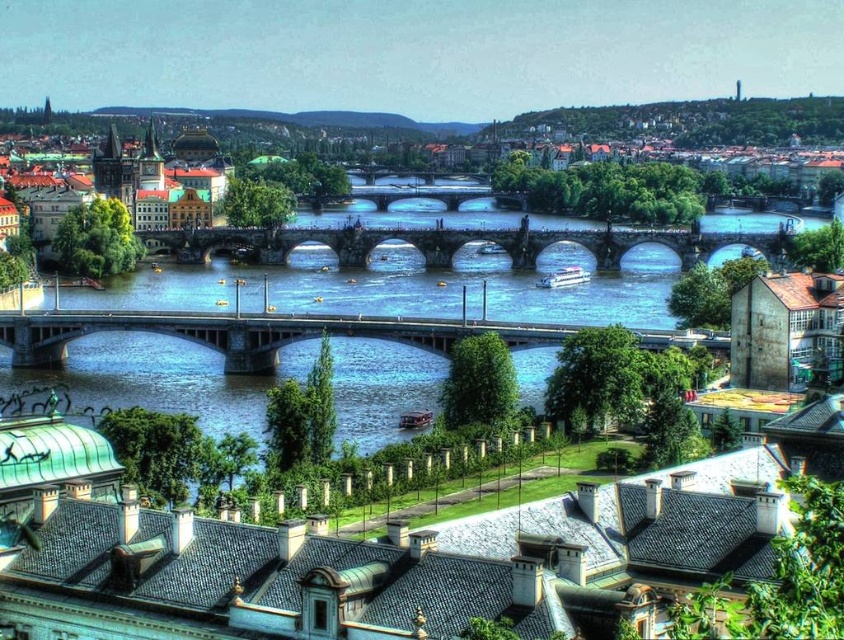
Does concrete bridge at center appear under stone arch bridge at center?

Correct, concrete bridge at center is located below stone arch bridge at center.

Between concrete bridge at center and stone arch bridge at center, which one has less height?

concrete bridge at center

The width and height of the screenshot is (844, 640). What do you see at coordinates (252, 332) in the screenshot?
I see `concrete bridge at center` at bounding box center [252, 332].

Identify the location of concrete bridge at center. Image resolution: width=844 pixels, height=640 pixels. (252, 332).